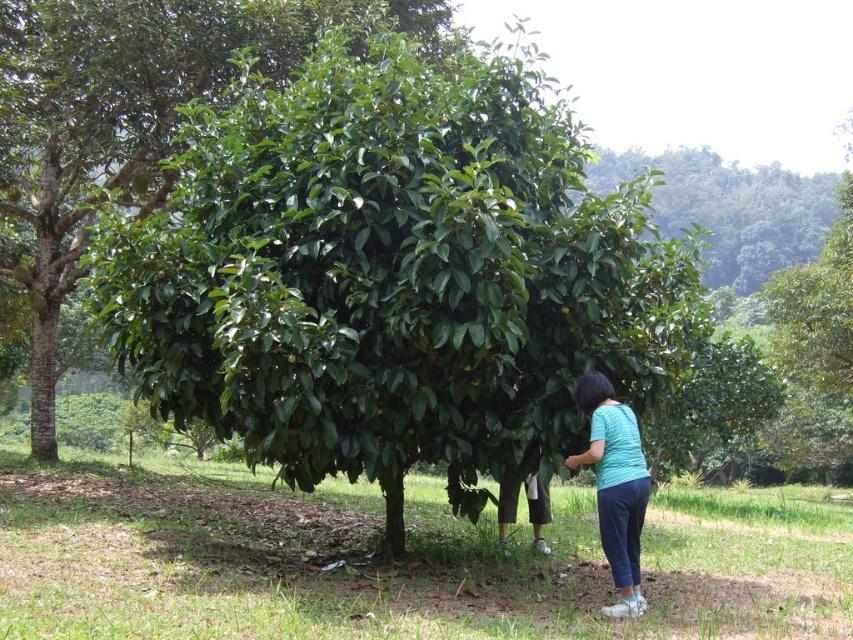
You are standing at the base of the tree in the image and want to walk towards the point labeled as point (535, 513). As you move forward, will you pass by the point labeled point (640, 182) before reaching your destination?

Yes, you will pass by point (640, 182) before reaching point (535, 513) because point (640, 182) is in front of point (535, 513) from your starting position at the tree base.

You are standing at the origin point of the coordinate system. Where is the green glossy tree at center located?

The green glossy tree at center is located at point (123, 120).